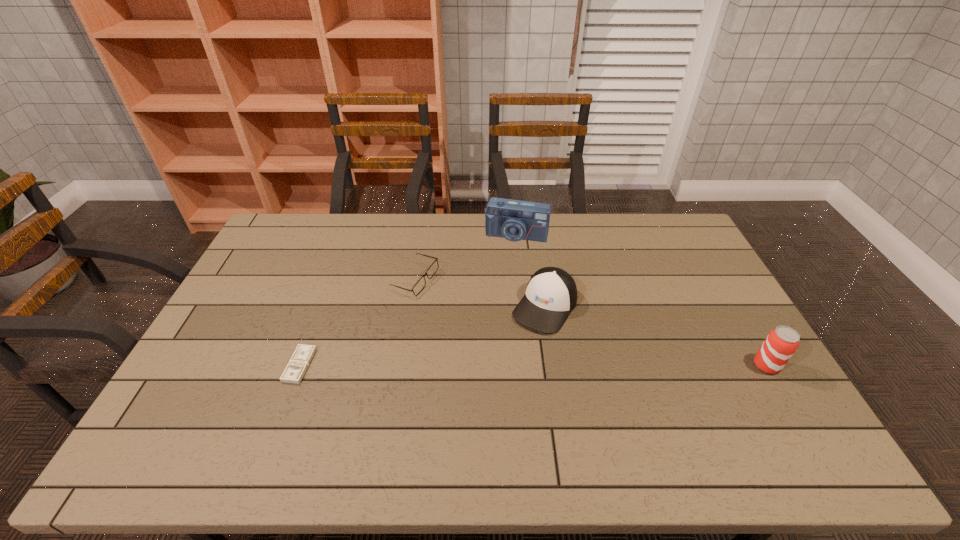
This screenshot has height=540, width=960. Find the location of `free area in between the farthest object and the second object from left to right`. free area in between the farthest object and the second object from left to right is located at coordinates [x=466, y=257].

This screenshot has width=960, height=540. Find the location of `vacant space that is in between the beer can and the farthest object`. vacant space that is in between the beer can and the farthest object is located at coordinates (641, 300).

The height and width of the screenshot is (540, 960). I want to click on free area in between the second object from left to right and the cap, so click(480, 293).

I want to click on unoccupied position between the farthest object and the money, so click(408, 300).

At what (x,y) coordinates should I click in order to perform the action: click on blank region between the beer can and the fourth tallest object. Please return your answer as a coordinate pair (x, y). Image resolution: width=960 pixels, height=540 pixels. Looking at the image, I should click on (590, 322).

Find the location of `free space between the spectacles and the rightmost object`. free space between the spectacles and the rightmost object is located at coordinates (590, 322).

Point out which object is positioned as the third nearest to the leftmost object. Please provide its 2D coordinates. Your answer should be formatted as a tuple, i.e. [(x, y)], where the tuple contains the x and y coordinates of a point satisfying the conditions above.

[(515, 220)]

Choose which object is the third nearest neighbor to the farthest object. Please provide its 2D coordinates. Your answer should be formatted as a tuple, i.e. [(x, y)], where the tuple contains the x and y coordinates of a point satisfying the conditions above.

[(303, 354)]

Locate an element on the screen. free space that satisfies the following two spatial constraints: 1. on the front side of the cap; 2. on the right side of the beer can is located at coordinates (554, 366).

I want to click on vacant region that satisfies the following two spatial constraints: 1. on the back side of the camera; 2. on the left side of the second shortest object, so click(x=422, y=235).